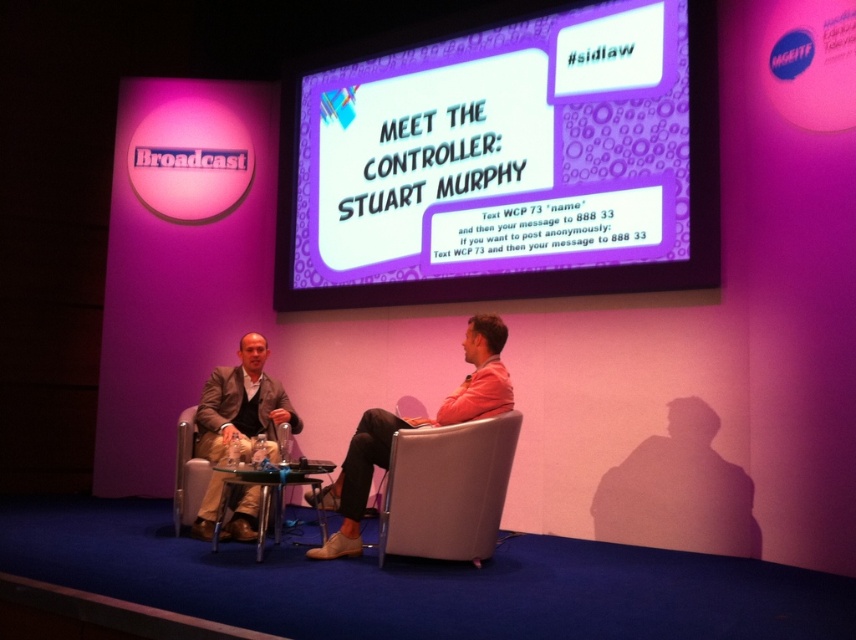
You are a stagehand who needs to place a 1.5 meter wide banner between the purple glossy projection screen at upper center and the leather at right. Is there enough space?

The distance between the purple glossy projection screen at upper center and the leather at right is 1.82 meters. Since the banner is 1.5 meters wide, there is enough space to place it between them.

You are a photographer positioned behind the stage. You have two points marked on your camera screen for focusing purposes. The first point is at coordinates point (378, 413) and the second is at point (182, 524). Which point is closer to your camera lens?

Point (378, 413) is closer to the camera lens than point (182, 524).

You are an event organizer who needs to adjust seating arrangements. If you want to seat a guest who prefers a taller chair, which chair should you choose between the leather at right and the metallic silver chair at center?

The leather at right is taller than the metallic silver chair at center, so you should choose the leather at right for the guest who prefers a taller chair.